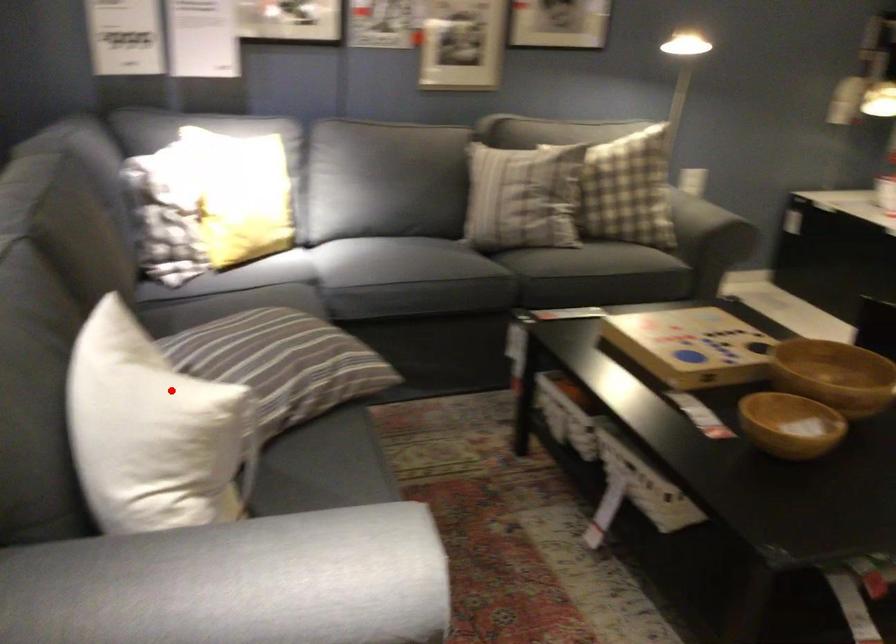
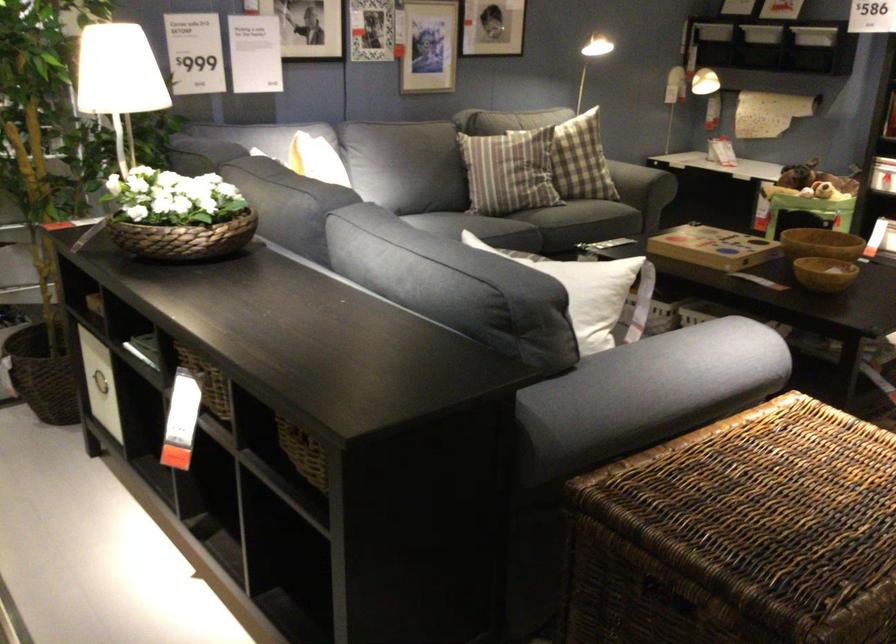
The point at the highlighted location is marked in the first image. Where is the corresponding point in the second image?

(581, 272)